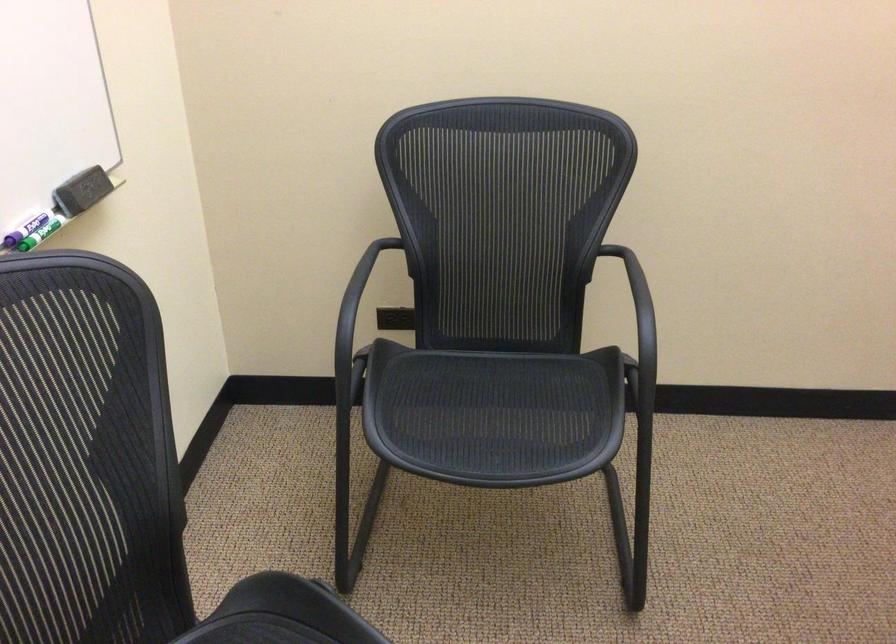
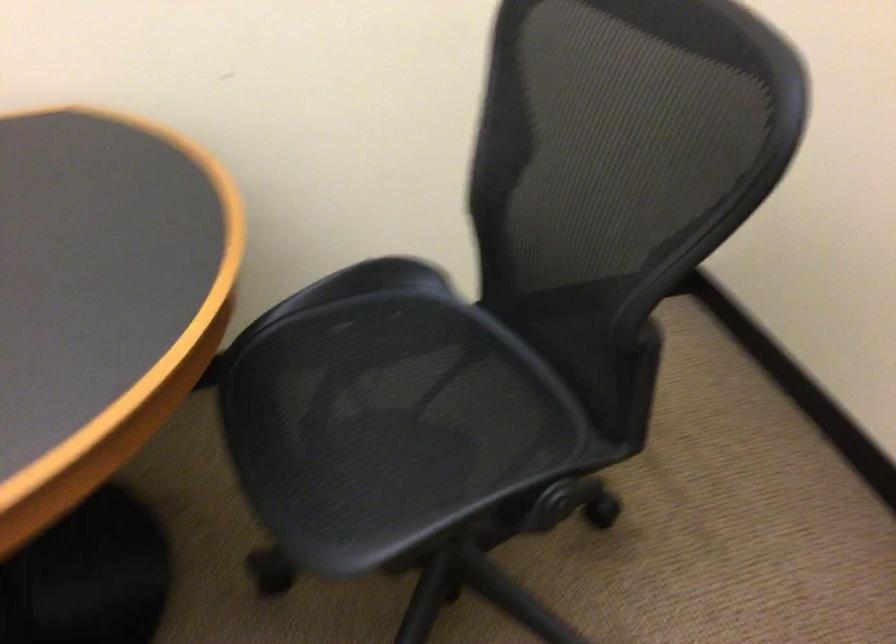
The images are taken continuously from a first-person perspective. In which direction is your viewpoint rotating?

The camera's rotation is toward right-down.